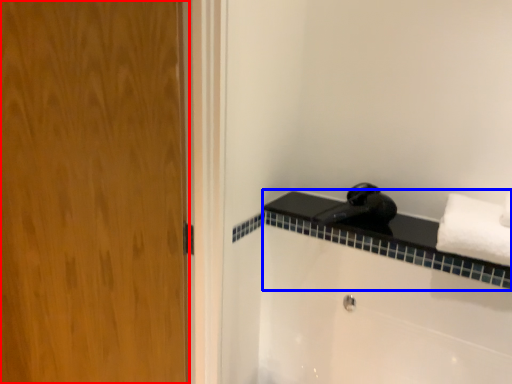
Question: Which object is closer to the camera taking this photo, door (highlighted by a red box) or balustrade (highlighted by a blue box)?

Choices:
 (A) door
 (B) balustrade

Answer: (A)